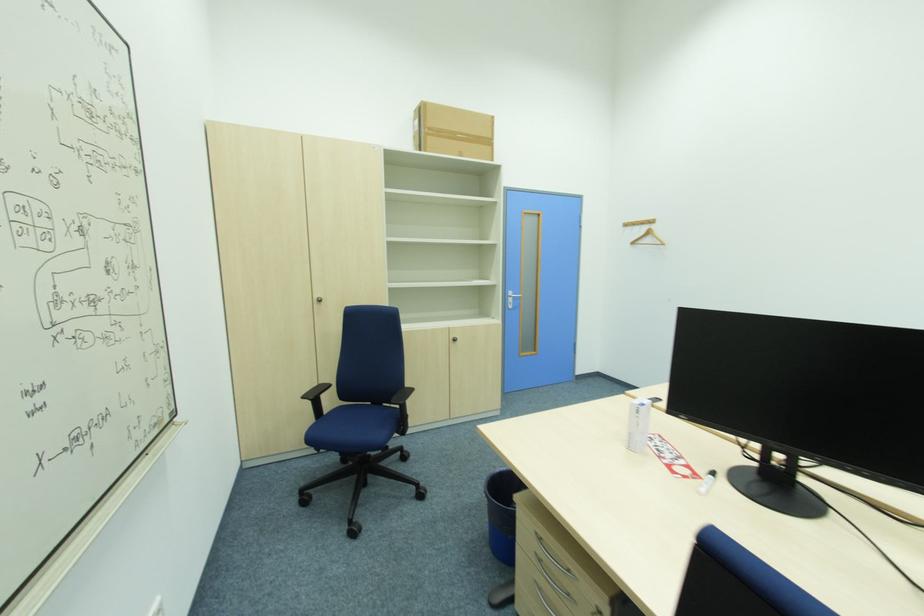
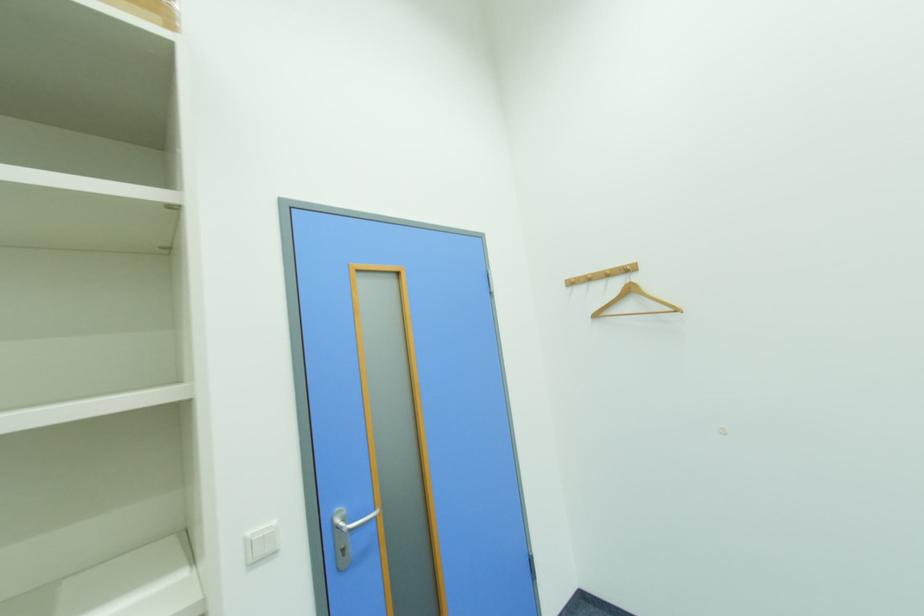
Locate, in the second image, the point that corresponds to [638,245] in the first image.

(601, 317)